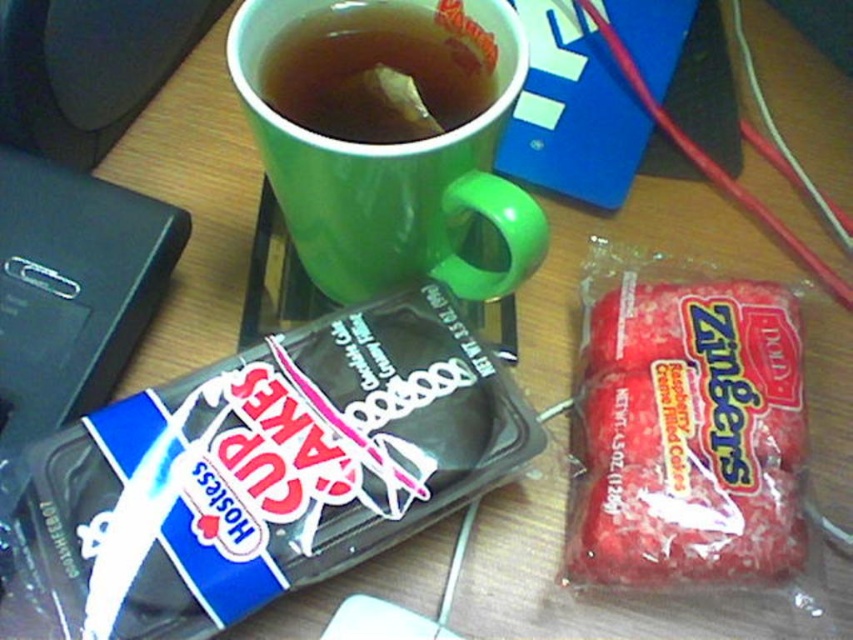
You have a small toy car that is 2 inches wide. You want to place it on the desk without overlapping any existing items. Can the red matte candy at right and the green matte mug at upper center fit side by side with the toy car between them?

The red matte candy at right is narrower than the green matte mug at upper center. Since the toy car is 2 inches wide, there might be enough space between them if the combined width of the candy and mug plus the car does not exceed the desk width. However, without knowing the exact desk dimensions, it is uncertain. But based on the candy being smaller, it could potentially work if arranged carefully.

You are organizing items on a desk and need to place the red matte candy at right and the green matte cup at upper center into a drawer. The drawer has a height limit of 10 cm. Can both items fit vertically if placed side by side?

The red matte candy at right is bigger than the green matte cup at upper center. However, without specific height measurements for each item, it is impossible to determine if they can fit within the 10 cm height limit when placed side by side.

You are organizing the desk items. You need to place the blue plastic cupcake at lower left and the red matte candy at right into a drawer. However, the drawer has a divider that separates it into two sections. The left section is narrower than the right. Which item should go into the left section?

The blue plastic cupcake at lower left should go into the left section because it is positioned under the red matte candy at right, indicating it might be smaller in width.